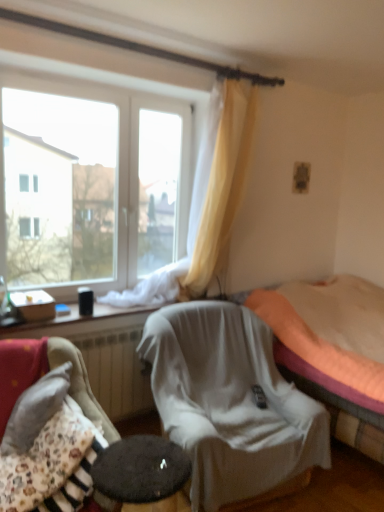
Identify the location of free location above transparent glass window at upper left, the 2th window ordered from the bottom (from a real-world perspective). This screenshot has width=384, height=512. (130, 85).